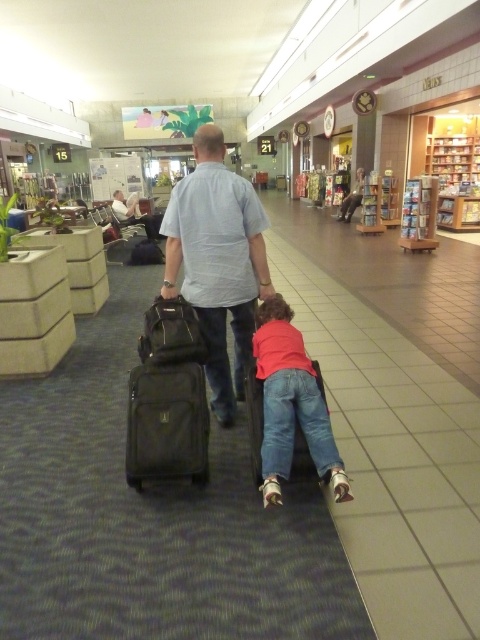
You are a passenger at the airport and need to locate two specific points marked in the scene. The first point is at coordinates point (218, 276) and the second is at point (279, 333). Based on their positions, which point is closer to the entrance of the terminal?

Point (279, 333) is closer to the entrance of the terminal because point (218, 276) is behind it, meaning it is further away from the entrance.

You are an airport staff member who needs to ensure all items are within the size restrictions for carryon luggage. The maximum width allowed is 50 cm. You observe the matte pink shirt at center and the matte black suitcase at center. Which item is wider and would exceed the size limit?

The matte pink shirt at center is wider than the matte black suitcase at center. If the maximum width allowed is 50 cm, the matte pink shirt at center would exceed the size limit if its width is over 50 cm, but the exact measurement isn